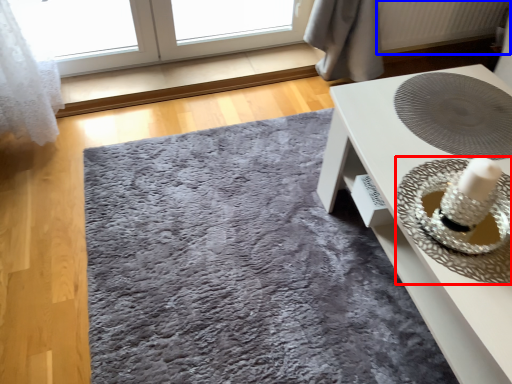
Question: Which object is further to the camera taking this photo, straw hat (highlighted by a red box) or radiator (highlighted by a blue box)?

Choices:
 (A) straw hat
 (B) radiator

Answer: (B)